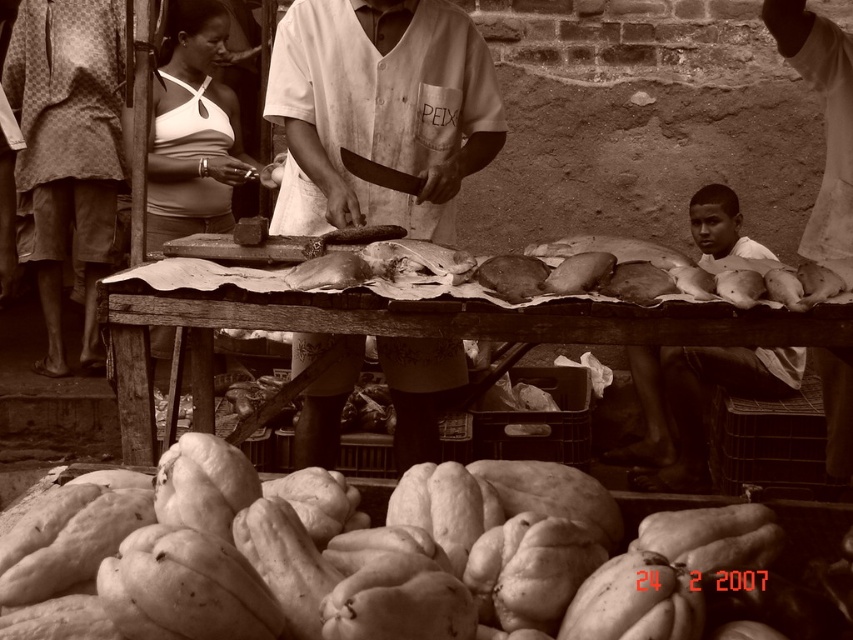
You are a vendor at this market and need to place a large basket of oranges on your table. The basket is the same size as the white fabric shirt at center. Will the basket fit on the wooden table at center?

The white fabric shirt at center is smaller than the wooden table at center, so the basket, being the same size as the shirt, will fit on the table.

What are the coordinates of the smooth white blouse at upper left?

The smooth white blouse at upper left is located at coordinates point [194,129].